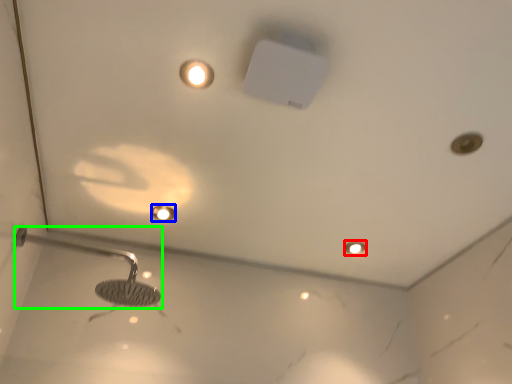
Question: Which object is the closest to the light fixture (highlighted by a red box)? Choose among these: droplight (highlighted by a blue box) or shower (highlighted by a green box).

Choices:
 (A) droplight
 (B) shower

Answer: (A)